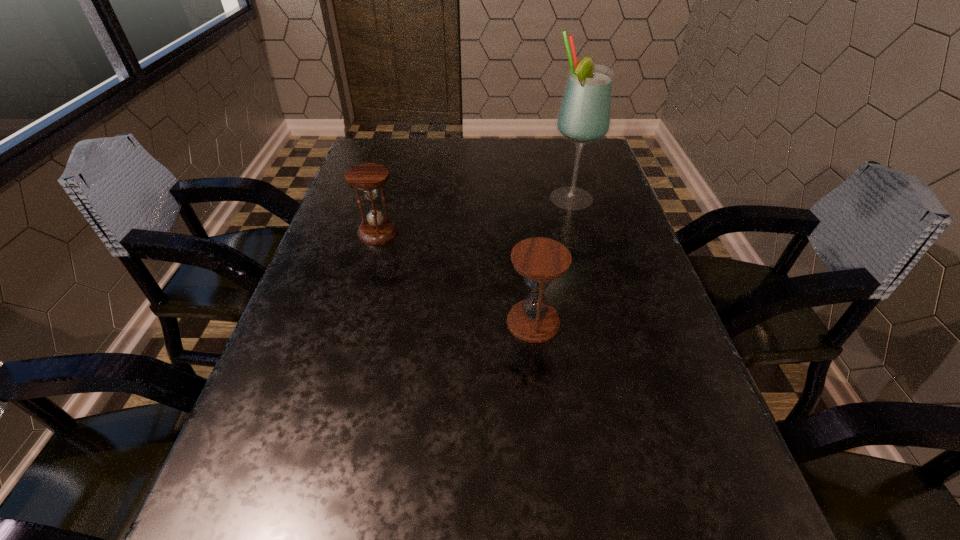
Where is `object that is at the right edge`? The width and height of the screenshot is (960, 540). object that is at the right edge is located at coordinates (584, 116).

You are a GUI agent. You are given a task and a screenshot of the screen. Output one action in this format:
    pyautogui.click(x=<x>, y=<y>)
    Task: Click on the free space at the far edge of the desktop
    
    Given the screenshot: What is the action you would take?
    pyautogui.click(x=444, y=166)

The width and height of the screenshot is (960, 540). In the image, there is a desktop. Identify the location of vacant space at the left edge. (329, 381).

In the image, there is a desktop. Where is `free space at the right edge`? The image size is (960, 540). free space at the right edge is located at coordinates (599, 315).

Image resolution: width=960 pixels, height=540 pixels. In the image, there is a desktop. Identify the location of vacant space at the far right corner. (555, 164).

Identify the location of vacant area between the right hourglass and the leftmost object. (456, 277).

Identify the location of unoccupied position between the farthest object and the second farthest object. Image resolution: width=960 pixels, height=540 pixels. (474, 216).

The height and width of the screenshot is (540, 960). I want to click on empty space that is in between the nearest object and the second farthest object, so click(456, 277).

Image resolution: width=960 pixels, height=540 pixels. I want to click on free spot between the nearest object and the farther hourglass, so click(456, 277).

You are a GUI agent. You are given a task and a screenshot of the screen. Output one action in this format:
    pyautogui.click(x=<x>, y=<y>)
    Task: Click on the free point between the farther hourglass and the nearest object
    The width and height of the screenshot is (960, 540).
    Given the screenshot: What is the action you would take?
    pyautogui.click(x=456, y=277)